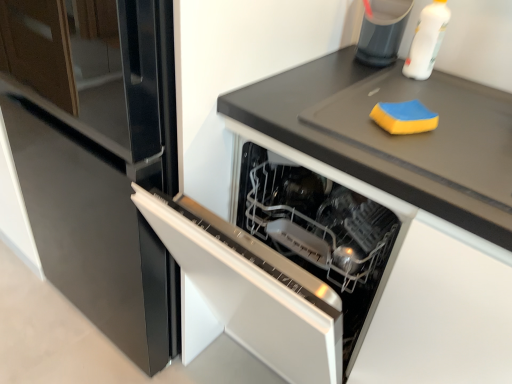
I want to click on sleek stainless steel dishwasher at center, so click(287, 259).

The image size is (512, 384). I want to click on black matte countertop at upper right, so click(x=395, y=136).

This screenshot has width=512, height=384. What do you see at coordinates (426, 40) in the screenshot? I see `white plastic bottle at upper right` at bounding box center [426, 40].

At what (x,y) coordinates should I click in order to perform the action: click on sleek stainless steel dishwasher at center. Please return your answer as a coordinate pair (x, y). Image resolution: width=512 pixels, height=384 pixels. Looking at the image, I should click on (287, 259).

Is sleek stainless steel dishwasher at center wider than white plastic bottle at upper right?

Indeed, sleek stainless steel dishwasher at center has a greater width compared to white plastic bottle at upper right.

Would you consider sleek stainless steel dishwasher at center to be distant from white plastic bottle at upper right?

No, there isn't a large distance between sleek stainless steel dishwasher at center and white plastic bottle at upper right.

Considering the relative sizes of sleek stainless steel dishwasher at center and white plastic bottle at upper right in the image provided, is sleek stainless steel dishwasher at center shorter than white plastic bottle at upper right?

No, sleek stainless steel dishwasher at center is not shorter than white plastic bottle at upper right.

In the image, is yellow sponge at upper right positioned in front of or behind sleek stainless steel dishwasher at center?

yellow sponge at upper right is behind sleek stainless steel dishwasher at center.

Does yellow sponge at upper right have a greater height compared to sleek stainless steel dishwasher at center?

No, yellow sponge at upper right is not taller than sleek stainless steel dishwasher at center.

Consider the image. Between yellow sponge at upper right and sleek stainless steel dishwasher at center, which one has smaller width?

With smaller width is yellow sponge at upper right.

Is yellow sponge at upper right aimed at sleek stainless steel dishwasher at center?

No, yellow sponge at upper right is not facing towards sleek stainless steel dishwasher at center.

This screenshot has height=384, width=512. I want to click on bottle above the translucent plastic container at upper right (from a real-world perspective), so click(x=426, y=40).

From the image's perspective, is white plastic bottle at upper right located above or below translucent plastic container at upper right?

From the image's perspective, white plastic bottle at upper right appears below translucent plastic container at upper right.

Is point (420, 17) more distant than point (387, 51)?

No, (420, 17) is closer to viewer.

Would you say white plastic bottle at upper right is inside or outside translucent plastic container at upper right?

white plastic bottle at upper right is outside translucent plastic container at upper right.

From a real-world perspective, who is located higher, yellow sponge at upper right or black matte countertop at upper right?

From a 3D spatial view, yellow sponge at upper right is above.

Based on their sizes in the image, would you say yellow sponge at upper right is bigger or smaller than black matte countertop at upper right?

yellow sponge at upper right is smaller than black matte countertop at upper right.

Who is taller, yellow sponge at upper right or black matte countertop at upper right?

black matte countertop at upper right is taller.

You are a GUI agent. You are given a task and a screenshot of the screen. Output one action in this format:
    pyautogui.click(x=<x>, y=<y>)
    Task: Click on the countertop lying below the translucent plastic container at upper right (from the image's perspective)
    
    Given the screenshot: What is the action you would take?
    pyautogui.click(x=395, y=136)

Considering the positions of objects translucent plastic container at upper right and black matte countertop at upper right in the image provided, who is in front, translucent plastic container at upper right or black matte countertop at upper right?

black matte countertop at upper right is more forward.

Does translucent plastic container at upper right have a greater height compared to black matte countertop at upper right?

Indeed, translucent plastic container at upper right has a greater height compared to black matte countertop at upper right.

Between translucent plastic container at upper right and black matte countertop at upper right, which one has larger size?

black matte countertop at upper right is bigger.

I want to click on home appliance below the black matte countertop at upper right (from the image's perspective), so click(287, 259).

Is sleek stainless steel dishwasher at center looking in the opposite direction of black matte countertop at upper right?

sleek stainless steel dishwasher at center does not have its back to black matte countertop at upper right.

Who is shorter, sleek stainless steel dishwasher at center or black matte countertop at upper right?

With less height is black matte countertop at upper right.

From a real-world perspective, is yellow sponge at upper right positioned under glossy black fridge at center based on gravity?

No, from a real-world perspective, yellow sponge at upper right is not beneath glossy black fridge at center.

Is yellow sponge at upper right placed right next to glossy black fridge at center?

No, yellow sponge at upper right is not making contact with glossy black fridge at center.

Does yellow sponge at upper right have a greater width compared to glossy black fridge at center?

No.

In order to click on home appliance on the left side of white plastic bottle at upper right in this screenshot , I will do tap(287, 259).

At what (x,y) coordinates should I click in order to perform the action: click on home appliance beneath the yellow sponge at upper right (from a real-world perspective). Please return your answer as a coordinate pair (x, y). Image resolution: width=512 pixels, height=384 pixels. Looking at the image, I should click on (287, 259).

Which object lies nearer to the anchor point black matte countertop at upper right, glossy black fridge at center or yellow sponge at upper right?

Based on the image, yellow sponge at upper right appears to be nearer to black matte countertop at upper right.

Estimate the real-world distances between objects in this image. Which object is closer to sleek stainless steel dishwasher at center, translucent plastic container at upper right or glossy black fridge at center?

glossy black fridge at center lies closer to sleek stainless steel dishwasher at center than the other object.

Looking at the image, which one is located further to glossy black fridge at center, translucent plastic container at upper right or yellow sponge at upper right?

yellow sponge at upper right.

Looking at the image, which one is located further to translucent plastic container at upper right, black matte countertop at upper right or glossy black fridge at center?

glossy black fridge at center is positioned further to the anchor translucent plastic container at upper right.

Which object lies nearer to the anchor point white plastic bottle at upper right, glossy black fridge at center or black matte countertop at upper right?

Based on the image, black matte countertop at upper right appears to be nearer to white plastic bottle at upper right.

From the image, which object appears to be farther from glossy black fridge at center, black matte countertop at upper right or yellow sponge at upper right?

Based on the image, yellow sponge at upper right appears to be further to glossy black fridge at center.

Which object lies nearer to the anchor point translucent plastic container at upper right, glossy black fridge at center or white plastic bottle at upper right?

Based on the image, white plastic bottle at upper right appears to be nearer to translucent plastic container at upper right.

From the image, which object appears to be nearer to sleek stainless steel dishwasher at center, black matte countertop at upper right or glossy black fridge at center?

Among the two, black matte countertop at upper right is located nearer to sleek stainless steel dishwasher at center.

Locate an element on the screen. home appliance between glossy black fridge at center and white plastic bottle at upper right in the horizontal direction is located at coordinates (287, 259).

Where is `food between glossy black fridge at center and black matte countertop at upper right`? This screenshot has height=384, width=512. food between glossy black fridge at center and black matte countertop at upper right is located at coordinates (404, 117).

In order to click on appliance between glossy black fridge at center and black matte countertop at upper right in the horizontal direction in this screenshot , I will do `click(382, 31)`.

Locate an element on the screen. This screenshot has height=384, width=512. appliance situated between glossy black fridge at center and white plastic bottle at upper right from left to right is located at coordinates (382, 31).